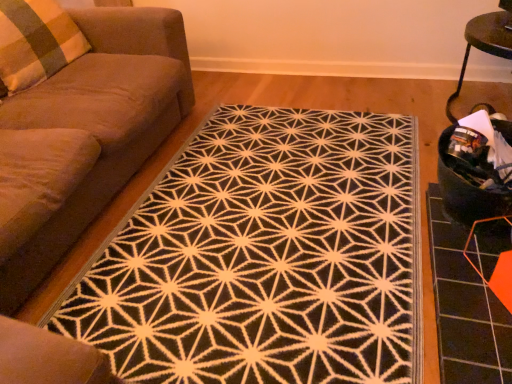
Question: Is orange hexagonal tile at lower right positioned far away from suede-like brown couch at left?

Choices:
 (A) yes
 (B) no

Answer: (A)

Question: Does orange hexagonal tile at lower right have a lesser height compared to suede-like brown couch at left?

Choices:
 (A) yes
 (B) no

Answer: (A)

Question: Does orange hexagonal tile at lower right have a greater height compared to suede-like brown couch at left?

Choices:
 (A) no
 (B) yes

Answer: (A)

Question: Is orange hexagonal tile at lower right positioned behind suede-like brown couch at left?

Choices:
 (A) no
 (B) yes

Answer: (B)

Question: Is suede-like brown couch at left surrounded by orange hexagonal tile at lower right?

Choices:
 (A) yes
 (B) no

Answer: (B)

Question: Could you tell me if orange hexagonal tile at lower right is facing suede-like brown couch at left?

Choices:
 (A) yes
 (B) no

Answer: (B)

Question: Does black fabric swivel chair at right come in front of suede-like brown couch at left?

Choices:
 (A) no
 (B) yes

Answer: (A)

Question: Would you say black fabric swivel chair at right is outside suede-like brown couch at left?

Choices:
 (A) no
 (B) yes

Answer: (B)

Question: Does black fabric swivel chair at right have a greater width compared to suede-like brown couch at left?

Choices:
 (A) no
 (B) yes

Answer: (A)

Question: Is black fabric swivel chair at right oriented away from suede-like brown couch at left?

Choices:
 (A) no
 (B) yes

Answer: (A)

Question: From a real-world perspective, is black fabric swivel chair at right positioned over suede-like brown couch at left based on gravity?

Choices:
 (A) yes
 (B) no

Answer: (B)

Question: Is there a large distance between black fabric swivel chair at right and suede-like brown couch at left?

Choices:
 (A) no
 (B) yes

Answer: (B)

Question: Is plaid fabric pillow at left a part of suede-like brown couch at left?

Choices:
 (A) yes
 (B) no

Answer: (A)